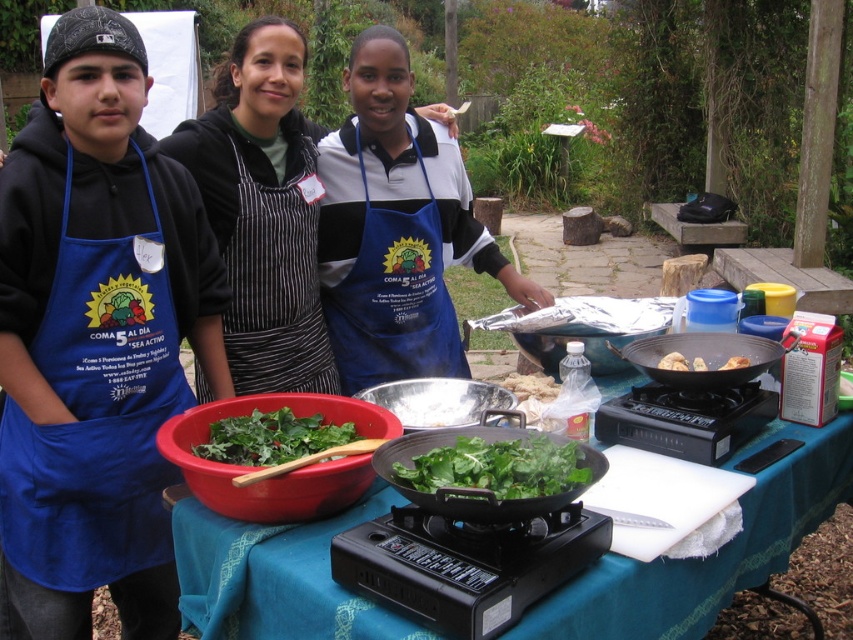
Can you confirm if blue fabric apron at left is shorter than blue apron at center?

Correct, blue fabric apron at left is not as tall as blue apron at center.

Who is positioned more to the left, blue fabric apron at left or blue apron at center?

Positioned to the left is blue fabric apron at left.

Who is more forward, (94, 321) or (358, 264)?

Positioned in front is point (94, 321).

Locate an element on the screen. blue fabric apron at left is located at coordinates (96, 413).

Between blue fabric apron at left and black striped apron at center, which one is positioned lower?

blue fabric apron at left is below.

Where is `blue fabric apron at left`? Image resolution: width=853 pixels, height=640 pixels. blue fabric apron at left is located at coordinates (96, 413).

Who is more distant from viewer, (178,385) or (259,440)?

Positioned behind is point (178,385).

Can you confirm if blue fabric apron at left is positioned to the right of green leafymaterial/texturevegetable at center?

In fact, blue fabric apron at left is to the left of green leafymaterial/texturevegetable at center.

Does point (39, 435) lie behind point (289, 444)?

Yes, it is behind point (289, 444).

Find the location of a particular element. blue fabric apron at left is located at coordinates (96, 413).